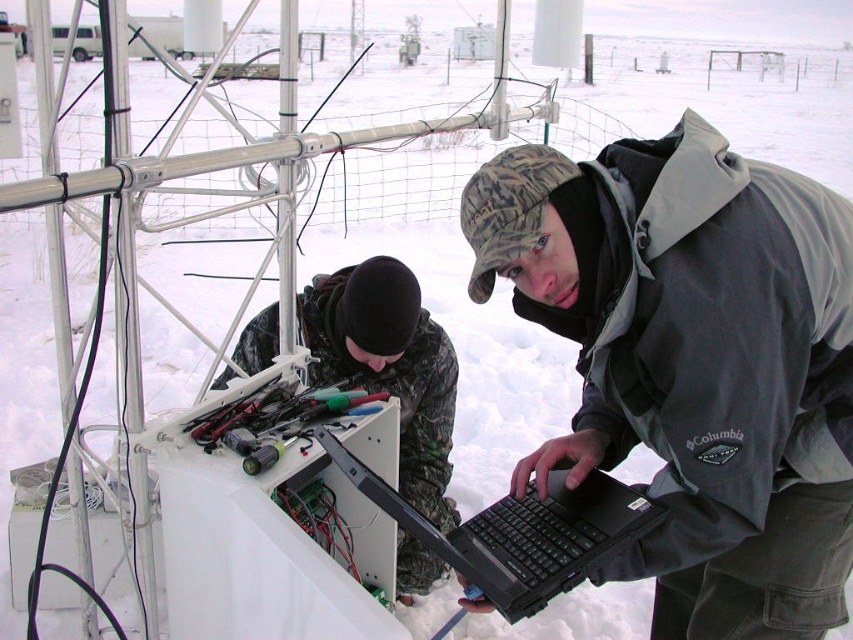
You are a field technician who needs to access both the black matte laptop at center and the metallic tools at center. Which object should you reach for first if you want to grab the one closer to your right hand?

The black matte laptop at center is positioned on the right side of metallic tools at center, so you should reach for the black matte laptop at center first as it is closer to your right hand.

Based on the scene description, which object is closer to the observer? The gray softshell jacket at center or the camouflage fabric jacket at lower center?

The gray softshell jacket at center is closer to the observer as it is positioned in front of the camouflage fabric jacket at lower center.

You are a technician who needs to access the metallic tools at center for a repair. Which direction should you move relative to the white plastic toolbox at center to reach them?

The metallic tools at center are to the right of the white plastic toolbox at center, so you should move to the right of the white plastic toolbox at center to reach them.